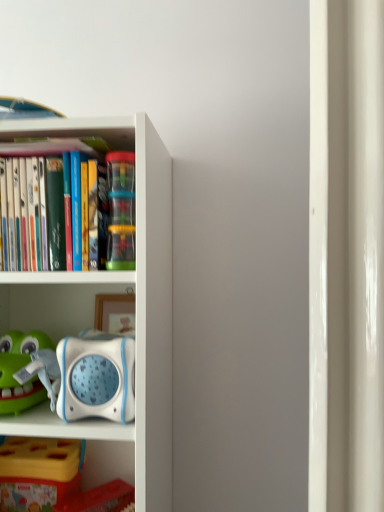
Question: Should I look upward or downward to see white plastic bookcase at left?

Choices:
 (A) down
 (B) up

Answer: (A)

Question: Is yellow plastic toy at lower left further to the viewer compared to translucent plastic cups at center?

Choices:
 (A) yes
 (B) no

Answer: (A)

Question: Is yellow plastic toy at lower left not near translucent plastic cups at center?

Choices:
 (A) yes
 (B) no

Answer: (B)

Question: From the image's perspective, does yellow plastic toy at lower left appear lower than translucent plastic cups at center?

Choices:
 (A) yes
 (B) no

Answer: (A)

Question: Does yellow plastic toy at lower left touch translucent plastic cups at center?

Choices:
 (A) yes
 (B) no

Answer: (B)

Question: From a real-world perspective, is yellow plastic toy at lower left beneath translucent plastic cups at center?

Choices:
 (A) yes
 (B) no

Answer: (A)

Question: From the image's perspective, is yellow plastic toy at lower left over translucent plastic cups at center?

Choices:
 (A) yes
 (B) no

Answer: (B)

Question: Considering the relative sizes of yellow plastic toy at lower left and white plastic bookcase at left in the image provided, is yellow plastic toy at lower left shorter than white plastic bookcase at left?

Choices:
 (A) yes
 (B) no

Answer: (A)

Question: Does yellow plastic toy at lower left appear on the left side of white plastic bookcase at left?

Choices:
 (A) yes
 (B) no

Answer: (A)

Question: Is there a large distance between yellow plastic toy at lower left and white plastic bookcase at left?

Choices:
 (A) no
 (B) yes

Answer: (A)

Question: Is white plastic bookcase at left completely or partially inside yellow plastic toy at lower left?

Choices:
 (A) no
 (B) yes

Answer: (A)

Question: Is yellow plastic toy at lower left positioned behind white plastic bookcase at left?

Choices:
 (A) no
 (B) yes

Answer: (B)

Question: From a real-world perspective, is yellow plastic toy at lower left over white plastic bookcase at left?

Choices:
 (A) yes
 (B) no

Answer: (B)

Question: From the image's perspective, would you say translucent plastic cups at center is shown under yellow plastic toy at lower left?

Choices:
 (A) yes
 (B) no

Answer: (B)